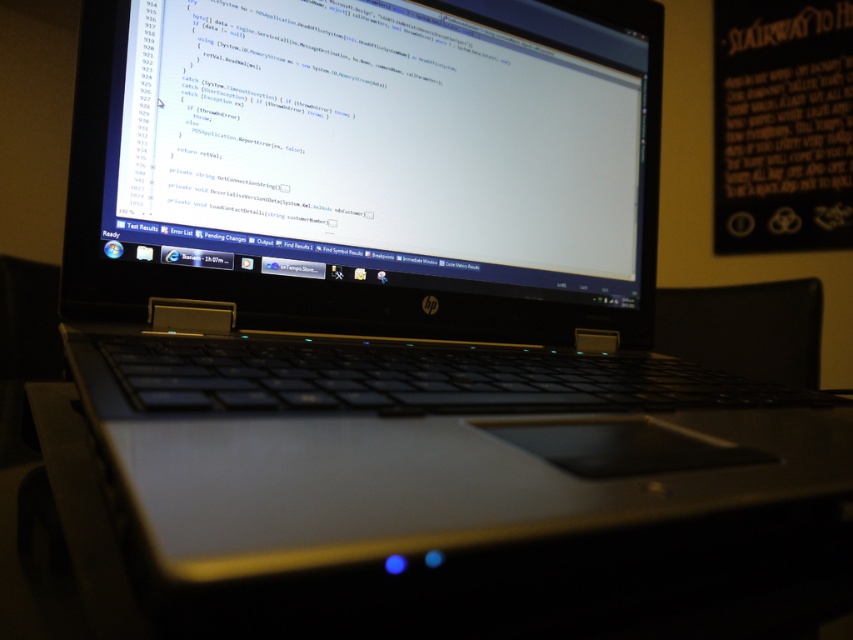
Question: Among these objects, which one is farthest from the camera?

Choices:
 (A) black matte bulletin board at upper right
 (B) white glossy screen at center

Answer: (A)

Question: In this image, where is white glossy screen at center located relative to black matte bulletin board at upper right?

Choices:
 (A) above
 (B) below

Answer: (B)

Question: Among these objects, which one is farthest from the camera?

Choices:
 (A) white glossy screen at center
 (B) black matte bulletin board at upper right

Answer: (B)

Question: Is white glossy screen at center further to the viewer compared to black matte bulletin board at upper right?

Choices:
 (A) no
 (B) yes

Answer: (A)

Question: Does white glossy screen at center appear under black matte bulletin board at upper right?

Choices:
 (A) yes
 (B) no

Answer: (A)

Question: Which point appears farthest from the camera in this image?

Choices:
 (A) (204, 182)
 (B) (802, 116)

Answer: (B)